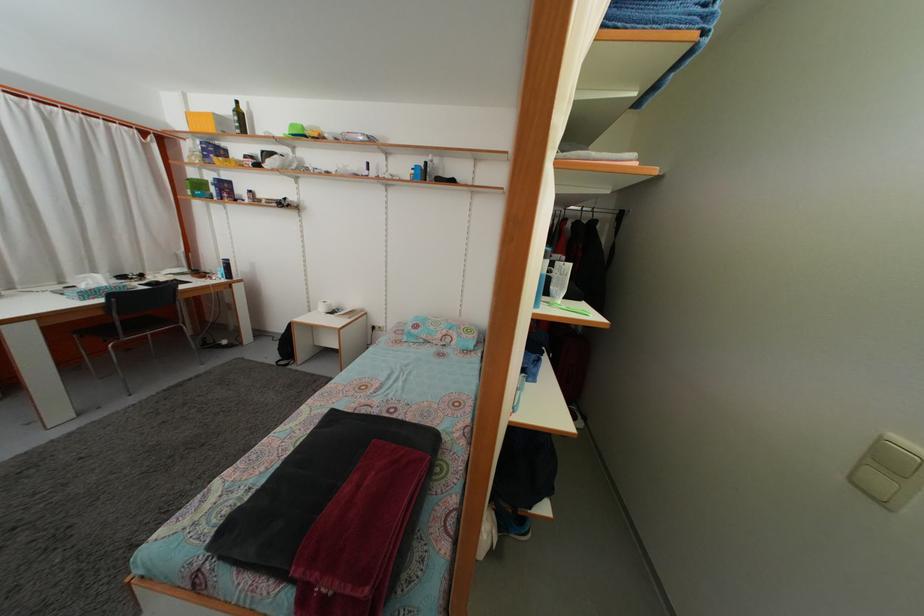
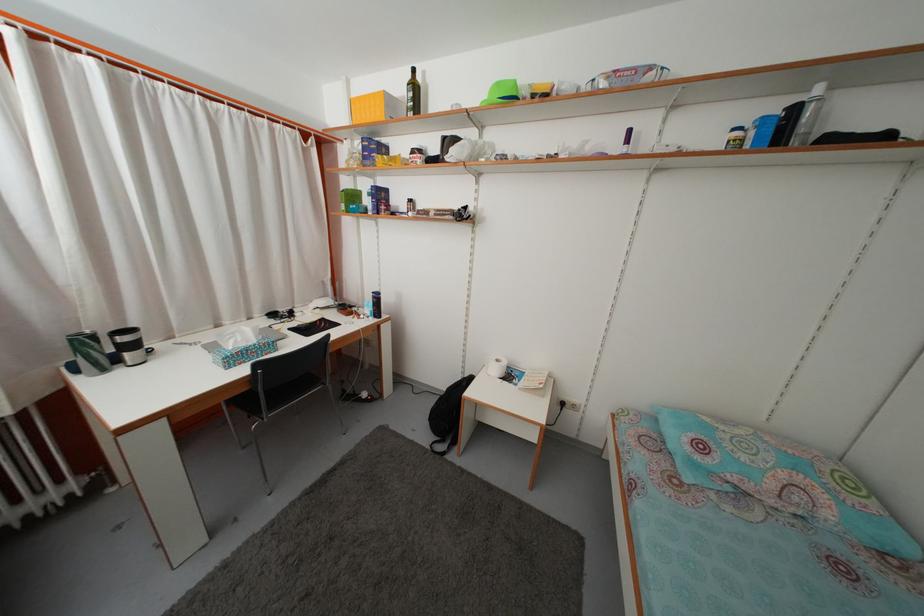
In a continuous first-person perspective shot, in which direction is the camera moving?

The movement direction of the cameraman is left, forward.